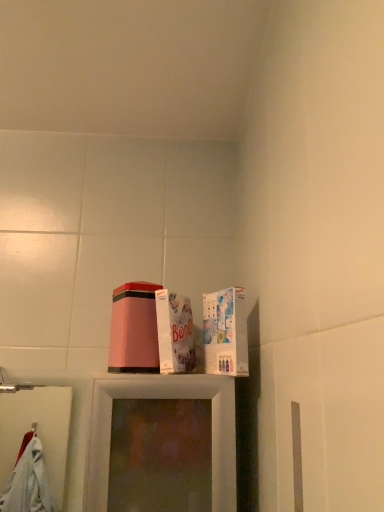
Question: Considering their positions, is white cardboard box at upper right, which is the 2th box from left to right, located in front of or behind white cardboard box at center, the 2th box in the right-to-left sequence?

Choices:
 (A) front
 (B) behind

Answer: (A)

Question: Is white cardboard box at upper right, the 1th box in the right-to-left sequence, taller or shorter than white cardboard box at center, the 2th box in the right-to-left sequence?

Choices:
 (A) short
 (B) tall

Answer: (A)

Question: Is point (240, 352) closer or farther from the camera than point (180, 333)?

Choices:
 (A) closer
 (B) farther

Answer: (A)

Question: From a real-world perspective, is white cardboard box at center, the 2th box in the right-to-left sequence, physically located above or below white cardboard box at upper right, which is the 2th box from left to right?

Choices:
 (A) below
 (B) above

Answer: (B)

Question: Is white cardboard box at center, the 2th box in the right-to-left sequence, spatially inside white cardboard box at upper right, which is the 2th box from left to right, or outside of it?

Choices:
 (A) outside
 (B) inside

Answer: (A)

Question: Based on their positions, is white cardboard box at center, the 2th box in the right-to-left sequence, located to the left or right of white cardboard box at upper right, the 1th box in the right-to-left sequence?

Choices:
 (A) right
 (B) left

Answer: (B)

Question: In the image, is white cardboard box at center, which is the 1th box in left-to-right order, positioned in front of or behind white cardboard box at upper right, which is the 2th box from left to right?

Choices:
 (A) behind
 (B) front

Answer: (A)